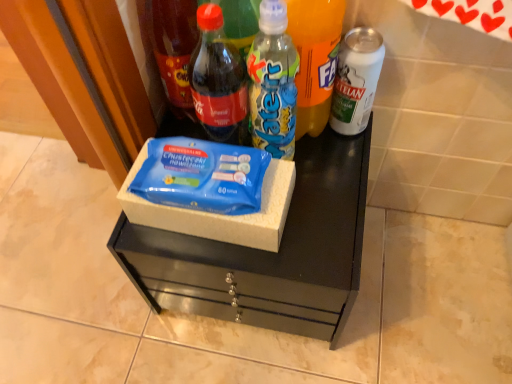
This screenshot has width=512, height=384. What are the coordinates of `vacant area to the right of translucent plastic water bottle at center, which is counted as the third bottle, starting from the right` in the screenshot? It's located at (333, 172).